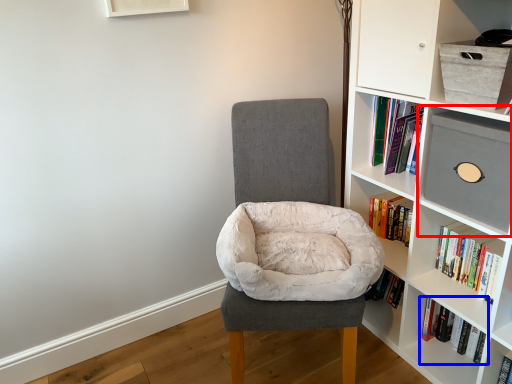
Question: Which of the following is the farthest to the observer, shelf (highlighted by a red box) or book (highlighted by a blue box)?

Choices:
 (A) shelf
 (B) book

Answer: (B)